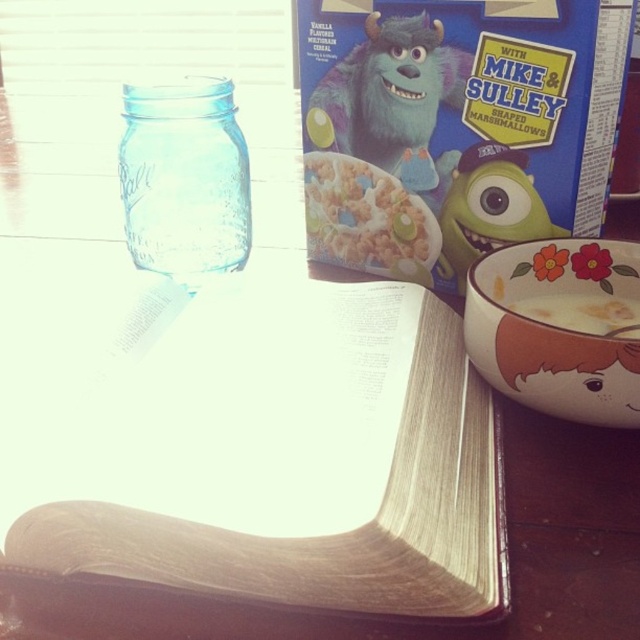
You are arranging items on a table for a breakfast nook. You have a light brown paper book at center and a white creamy cereal at lower right. Where should you place a decorative vase so that it is between these two items?

Place the decorative vase between the light brown paper book at center and the white creamy cereal at lower right, since the light brown paper book at center is to the left of the white creamy cereal at lower right.

You are sitting at the wooden table and want to place a small vase between the two points marked as point (192, 156) and point (513, 310). Which point should the vase be closer to in order to be closer to you?

The vase should be closer to point (192, 156) because it is closer to you than point (513, 310).